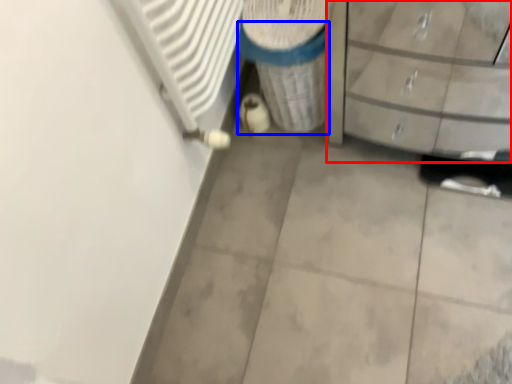
Question: Which of the following is the closest to the observer, chest of drawers (highlighted by a red box) or recycling bin (highlighted by a blue box)?

Choices:
 (A) chest of drawers
 (B) recycling bin

Answer: (A)